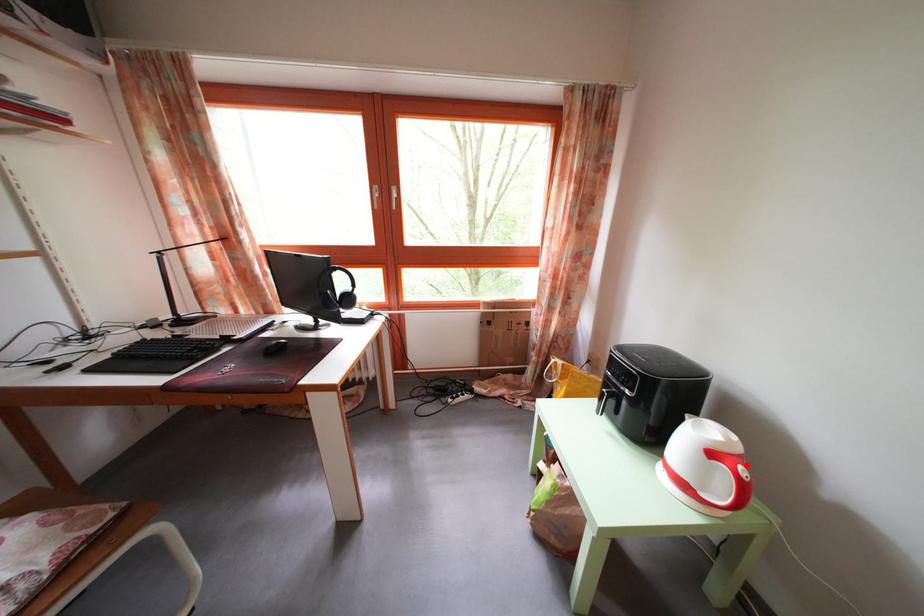
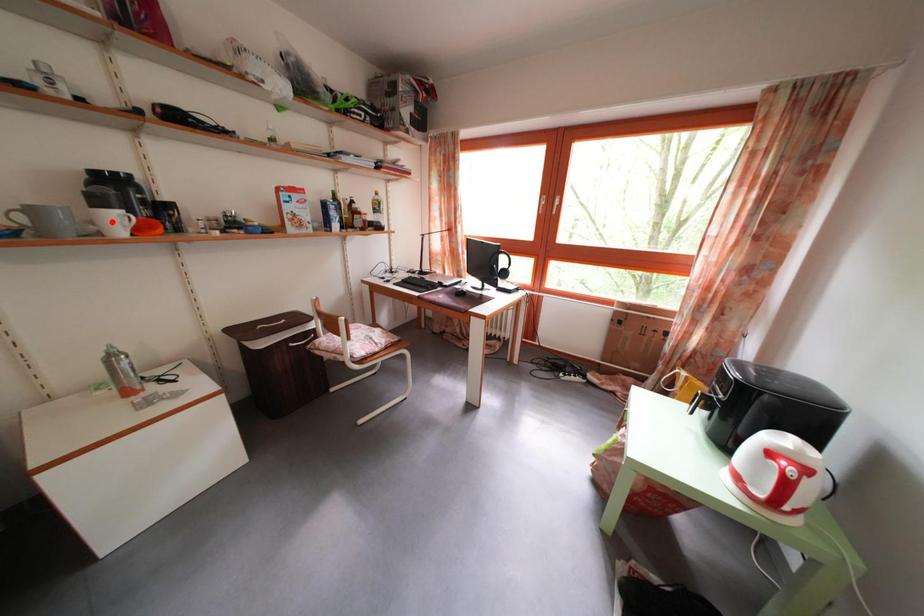
I am providing you with two images of the same scene from different viewpoints. A red point is marked on the first image and another point is marked on the second image. Are the points marked in image1 and image2 representing the same 3D position?

No